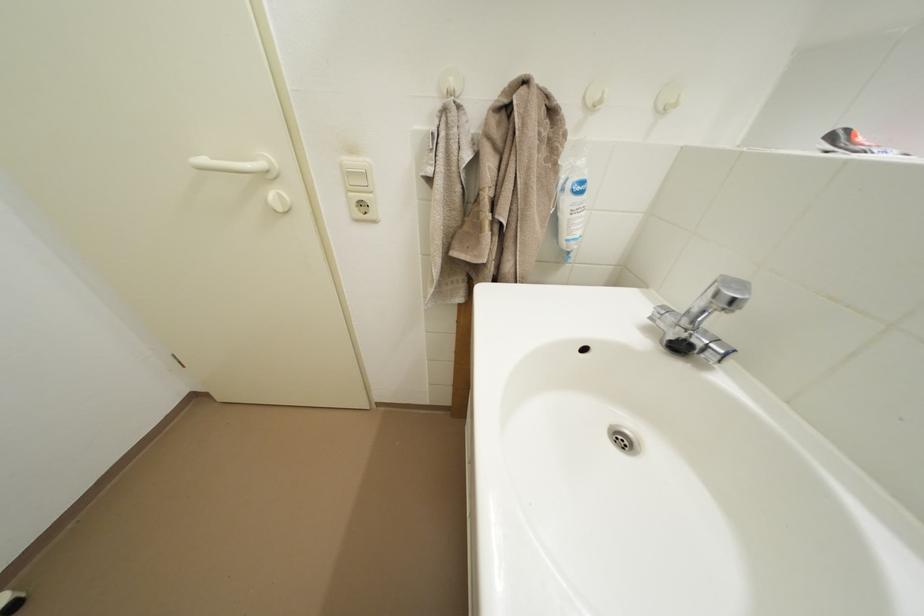
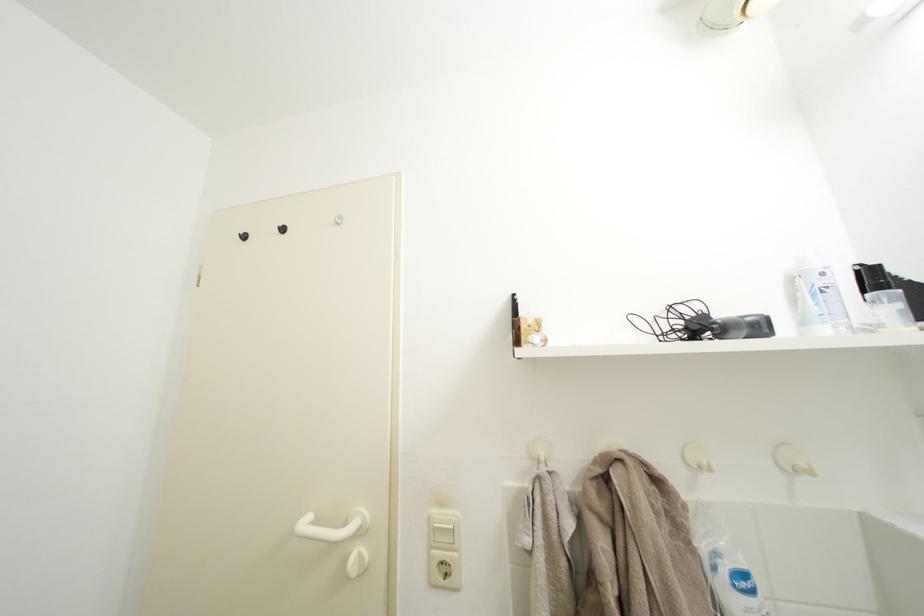
Find the pixel in the second image that matches [350,172] in the first image.

(438, 525)